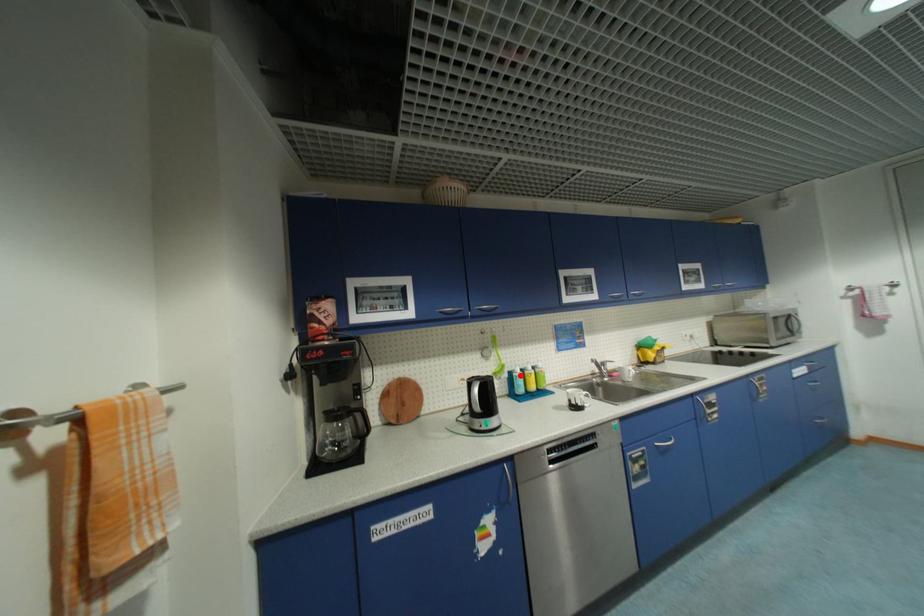
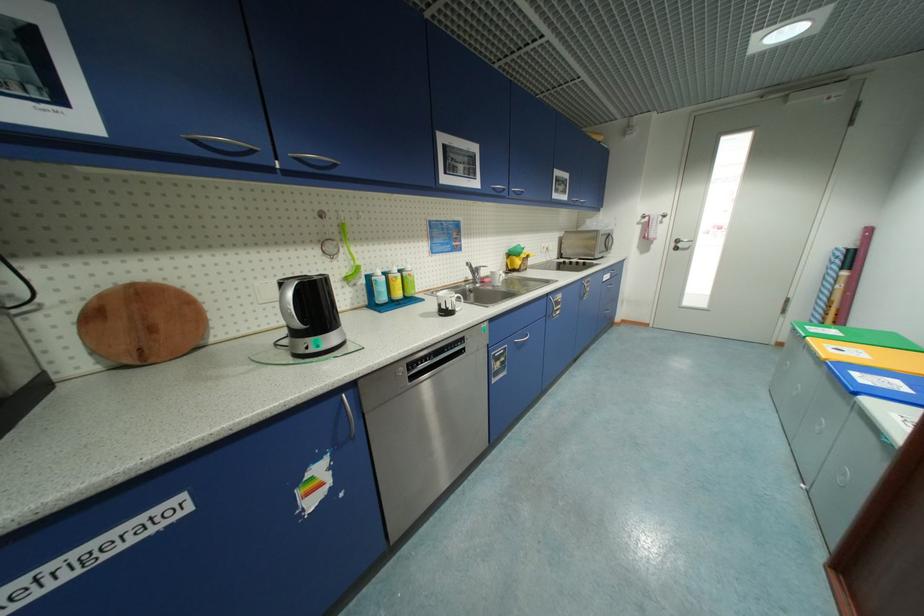
Question: A red point is marked in image1. In image2, is the corresponding 3D point closer to the camera or farther? Reply with the corresponding letter.

Choices:
 (A) The corresponding 3D point is closer.
 (B) The corresponding 3D point is farther.

Answer: (A)